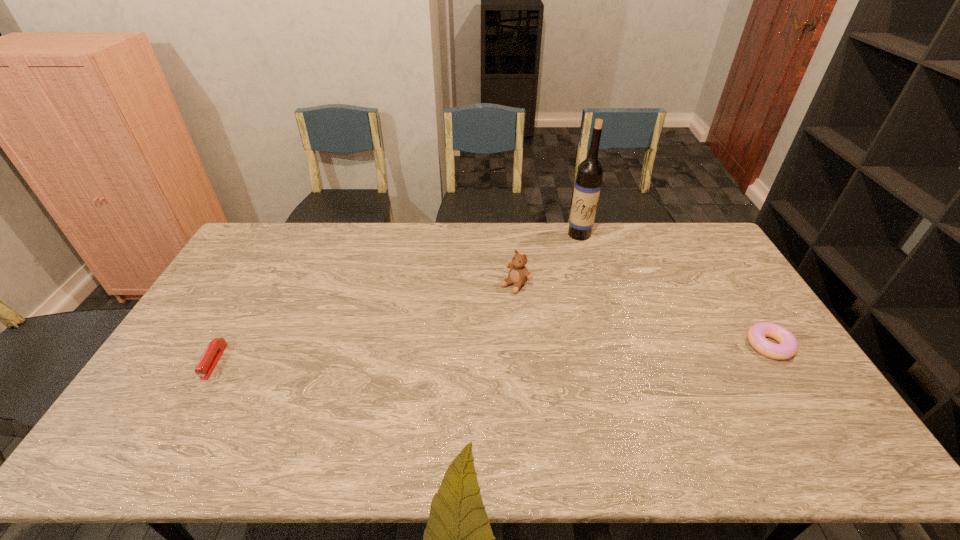
This screenshot has height=540, width=960. I want to click on vacant region between the farthest object and the second tallest object, so click(547, 259).

At what (x,y) coordinates should I click in order to perform the action: click on free point between the second object from right to left and the stapler. Please return your answer as a coordinate pair (x, y). The image size is (960, 540). Looking at the image, I should click on click(x=396, y=298).

Where is `empty space between the third object from right to left and the doughnut`? The width and height of the screenshot is (960, 540). empty space between the third object from right to left and the doughnut is located at coordinates (x=642, y=315).

Identify which object is the third nearest to the stapler. Please provide its 2D coordinates. Your answer should be formatted as a tuple, i.e. [(x, y)], where the tuple contains the x and y coordinates of a point satisfying the conditions above.

[(788, 345)]

You are a GUI agent. You are given a task and a screenshot of the screen. Output one action in this format:
    pyautogui.click(x=<x>, y=<y>)
    Task: Click on the second closest object to the rightmost object
    
    Given the screenshot: What is the action you would take?
    pos(518,274)

Identify the location of vacant space that satisfies the following two spatial constraints: 1. on the back side of the second object from left to right; 2. on the left side of the second object from right to left. [511, 234].

In order to click on free location that satisfies the following two spatial constraints: 1. on the front side of the second object from right to left; 2. on the left side of the doughnut in this screenshot , I will do `click(612, 345)`.